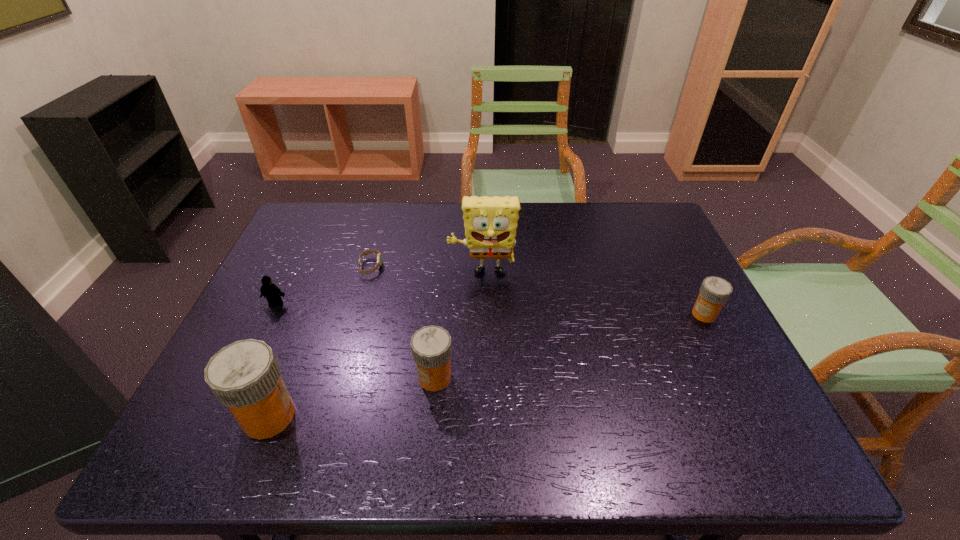
You are a GUI agent. You are given a task and a screenshot of the screen. Output one action in this format:
    pyautogui.click(x=<x>, y=<y>)
    Task: Click on the vacant space located 0.390m on the label side of the tallest medicine
    The image size is (960, 540).
    Given the screenshot: What is the action you would take?
    pyautogui.click(x=486, y=416)

Identify the location of free space located 0.090m on the label side of the third tallest object. The width and height of the screenshot is (960, 540). (376, 377).

Where is `free space located on the label side of the third tallest object`? Image resolution: width=960 pixels, height=540 pixels. free space located on the label side of the third tallest object is located at coordinates (282, 377).

Where is `vacant space located 0.260m on the label side of the third tallest object`? The height and width of the screenshot is (540, 960). vacant space located 0.260m on the label side of the third tallest object is located at coordinates (300, 377).

Where is `vacant space located on the label side of the rightmost medicine`? Image resolution: width=960 pixels, height=540 pixels. vacant space located on the label side of the rightmost medicine is located at coordinates (577, 314).

Where is `vacant space located 0.130m on the label side of the rightmost medicine`? The image size is (960, 540). vacant space located 0.130m on the label side of the rightmost medicine is located at coordinates (640, 314).

In order to click on vacant space located 0.350m on the label side of the rightmost medicine in this screenshot , I will do `click(554, 314)`.

Where is `free space located on the face of the tallest object`? The image size is (960, 540). free space located on the face of the tallest object is located at coordinates (483, 413).

The image size is (960, 540). What are the coordinates of `free spot located 0.350m on the face of the shortest object` in the screenshot? It's located at (504, 267).

Where is `blank space located 0.170m on the face of the Lego`? blank space located 0.170m on the face of the Lego is located at coordinates (249, 360).